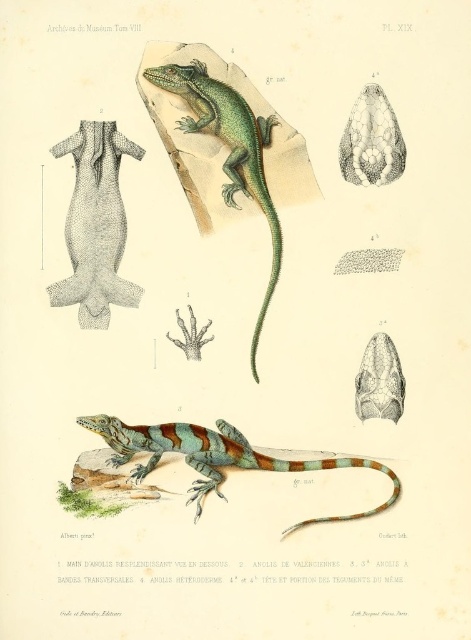
Question: Does multicolored painted lizard at center have a smaller size compared to green glossy lizard at upper center?

Choices:
 (A) no
 (B) yes

Answer: (B)

Question: Can you confirm if multicolored painted lizard at center is positioned to the left of green glossy lizard at upper center?

Choices:
 (A) yes
 (B) no

Answer: (A)

Question: Which point appears farthest from the camera in this image?

Choices:
 (A) (88, 296)
 (B) (154, 460)
 (C) (246, 115)

Answer: (A)

Question: Which object is the farthest from the multicolored painted lizard at center?

Choices:
 (A) gray textured tail at center
 (B) green glossy lizard at upper center

Answer: (A)

Question: Does gray textured tail at center appear on the left side of green glossy lizard at upper center?

Choices:
 (A) yes
 (B) no

Answer: (A)

Question: Considering the real-world distances, which object is farthest from the green glossy lizard at upper center?

Choices:
 (A) multicolored painted lizard at center
 (B) gray textured tail at center

Answer: (A)